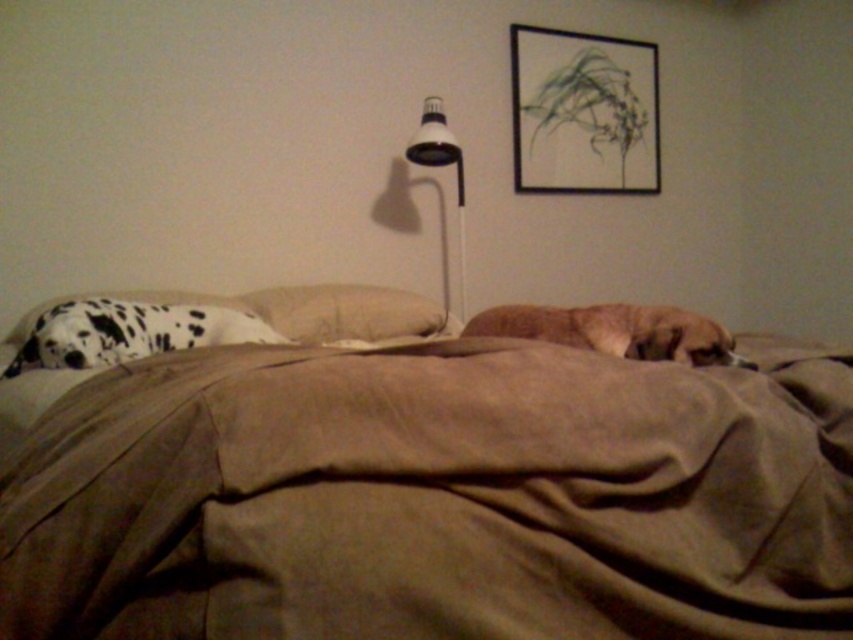
Is matte black picture frame at upper right below spotted fur dog at left?

Actually, matte black picture frame at upper right is above spotted fur dog at left.

Between matte black picture frame at upper right and spotted fur dog at left, which one appears on the left side from the viewer's perspective?

spotted fur dog at left is more to the left.

Find the location of `matte black picture frame at upper right`. matte black picture frame at upper right is located at coordinates (583, 113).

Find the location of `matte black picture frame at upper right`. matte black picture frame at upper right is located at coordinates (583, 113).

Consider the image. How distant is matte black picture frame at upper right from beige cotton pillow at center?

matte black picture frame at upper right is 1.15 meters away from beige cotton pillow at center.

Is point (524, 134) farther from camera compared to point (374, 316)?

That is True.

This screenshot has height=640, width=853. I want to click on matte black picture frame at upper right, so click(x=583, y=113).

Does point (706, 458) come behind point (424, 104)?

No, it is in front of (424, 104).

Does point (146, 500) lie behind point (450, 152)?

That is False.

I want to click on brown cotton bed at center, so click(x=428, y=496).